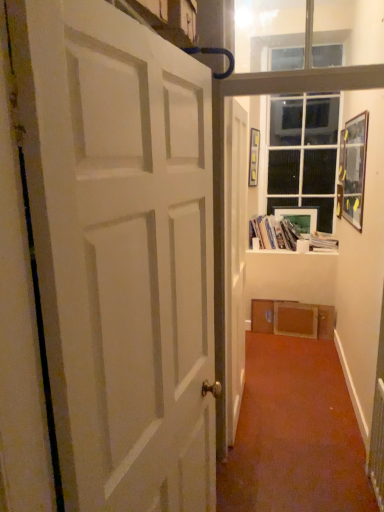
Question: Does wooden picture frame at upper right, marked as the second picture frame in a back-to-front arrangement, have a larger size compared to white matte door at center, the 1th door from the right?

Choices:
 (A) no
 (B) yes

Answer: (A)

Question: Considering the relative positions of wooden picture frame at upper right, placed as the 1th picture frame when sorted from front to back, and white matte door at center, the 1th door from the right, in the image provided, is wooden picture frame at upper right, placed as the 1th picture frame when sorted from front to back, in front of white matte door at center, the 1th door from the right,?

Choices:
 (A) yes
 (B) no

Answer: (B)

Question: Considering the relative sizes of wooden picture frame at upper right, placed as the 1th picture frame when sorted from front to back, and white matte door at center, positioned as the 2th door in left-to-right order, in the image provided, is wooden picture frame at upper right, placed as the 1th picture frame when sorted from front to back, shorter than white matte door at center, positioned as the 2th door in left-to-right order,?

Choices:
 (A) yes
 (B) no

Answer: (A)

Question: Can you confirm if wooden picture frame at upper right, marked as the second picture frame in a back-to-front arrangement, is positioned to the left of white matte door at center, arranged as the 1th door when viewed from the back?

Choices:
 (A) yes
 (B) no

Answer: (B)

Question: Does wooden picture frame at upper right, marked as the second picture frame in a back-to-front arrangement, appear on the right side of white matte door at center, positioned as the 2th door in left-to-right order?

Choices:
 (A) no
 (B) yes

Answer: (B)

Question: From the image's perspective, is wooden picture frame at upper right, placed as the 1th picture frame when sorted from front to back, under white matte door at center, arranged as the 1th door when viewed from the back?

Choices:
 (A) no
 (B) yes

Answer: (A)

Question: Is white paper stack at upper right, which is the 1th book in right-to-left order, behind white matte door at left, which is the first door from left to right?

Choices:
 (A) yes
 (B) no

Answer: (A)

Question: Is white matte door at left, which is the first door from left to right, surrounded by white paper stack at upper right, which is the 1th book in right-to-left order?

Choices:
 (A) yes
 (B) no

Answer: (B)

Question: Is white paper stack at upper right, the 2th book viewed from the left, placed right next to white matte door at left, the 1th door when ordered from front to back?

Choices:
 (A) yes
 (B) no

Answer: (B)

Question: Is white paper stack at upper right, the 2th book viewed from the left, positioned far away from white matte door at left, which is counted as the second door, starting from the back?

Choices:
 (A) yes
 (B) no

Answer: (A)

Question: From the image's perspective, is white paper stack at upper right, the 2th book viewed from the left, above white matte door at left, which is the first door from left to right?

Choices:
 (A) yes
 (B) no

Answer: (A)

Question: From a real-world perspective, is white paper stack at upper right, which is the 1th book in right-to-left order, physically below white matte door at left, which is counted as the second door, starting from the back?

Choices:
 (A) no
 (B) yes

Answer: (B)

Question: Is white plastic radiator at lower right taller than matte plastic picture frame at upper center, which is the first picture frame from back to front?

Choices:
 (A) yes
 (B) no

Answer: (A)